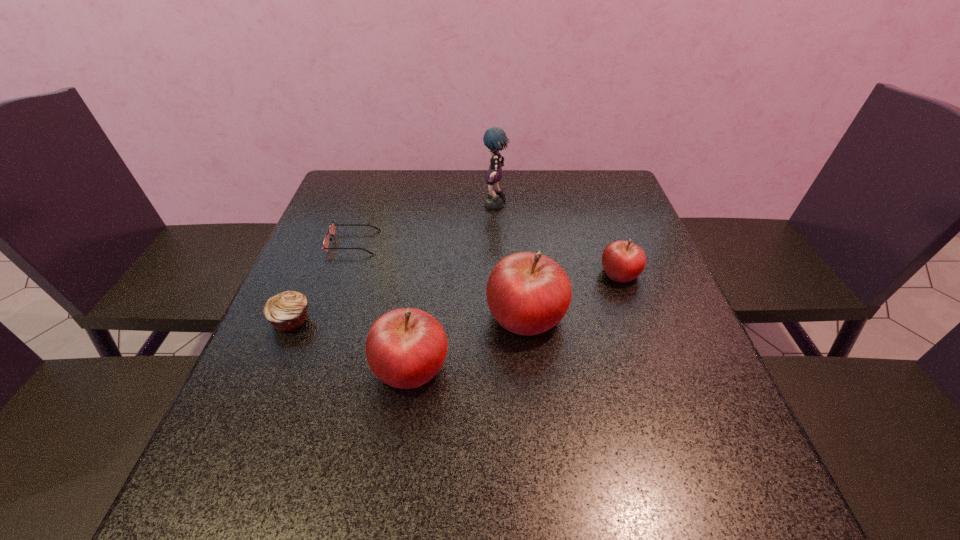
Locate an element on the screen. The height and width of the screenshot is (540, 960). muffin that is at the left edge is located at coordinates (287, 311).

At what (x,y) coordinates should I click in order to perform the action: click on object at the right edge. Please return your answer as a coordinate pair (x, y). Looking at the image, I should click on (623, 261).

In the image, there is a desktop. Identify the location of vacant region at the far edge. The image size is (960, 540). (436, 181).

You are a GUI agent. You are given a task and a screenshot of the screen. Output one action in this format:
    pyautogui.click(x=<x>, y=<y>)
    Task: Click on the free location at the near edge of the desktop
    
    Given the screenshot: What is the action you would take?
    pyautogui.click(x=565, y=418)

Identify the location of vacant space at the left edge of the desktop. (309, 250).

Image resolution: width=960 pixels, height=540 pixels. Identify the location of vacant space at the right edge of the desktop. (718, 383).

I want to click on vacant space at the far right corner, so click(x=631, y=208).

You are a GUI agent. You are given a task and a screenshot of the screen. Output one action in this format:
    pyautogui.click(x=<x>, y=<y>)
    Task: Click on the vacant area that lies between the third tallest object and the tallest object
    
    Given the screenshot: What is the action you would take?
    pyautogui.click(x=453, y=286)

This screenshot has width=960, height=540. I want to click on vacant point located between the second farthest object and the muffin, so click(x=323, y=281).

Find the location of a particular element. free spot between the second shortest object and the tallest object is located at coordinates (394, 262).